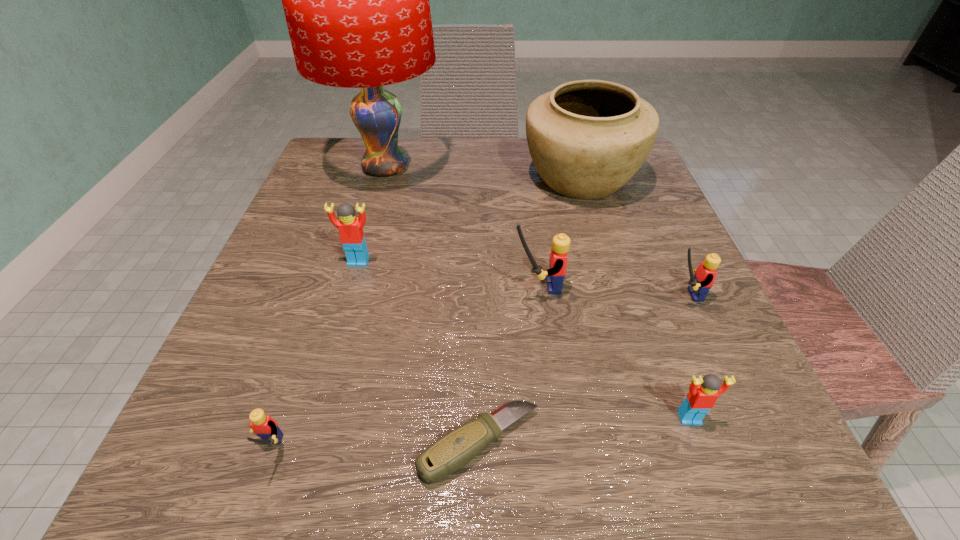
Where is `object present at the near left corner`? This screenshot has width=960, height=540. object present at the near left corner is located at coordinates (265, 427).

You are a GUI agent. You are given a task and a screenshot of the screen. Output one action in this format:
    pyautogui.click(x=<x>, y=<y>)
    Task: Click on the object located in the far right corner section of the desktop
    This screenshot has height=540, width=960.
    Given the screenshot: What is the action you would take?
    pyautogui.click(x=587, y=138)

Locate an element on the screen. This screenshot has height=540, width=960. object that is at the near right corner is located at coordinates (703, 393).

This screenshot has height=540, width=960. What are the coordinates of `vacant point at the far edge` in the screenshot? It's located at (462, 192).

This screenshot has height=540, width=960. I want to click on vacant space at the near edge of the desktop, so click(544, 429).

In the image, there is a desktop. Identify the location of free space at the left edge. (370, 210).

This screenshot has height=540, width=960. I want to click on free space at the right edge of the desktop, so click(665, 311).

Identify the location of vacant position at the far left corner of the desktop. The height and width of the screenshot is (540, 960). (354, 172).

Where is `vacant region at the far right corner of the desktop`? vacant region at the far right corner of the desktop is located at coordinates (630, 184).

This screenshot has width=960, height=540. I want to click on vacant space at the near right corner of the desktop, so click(x=768, y=468).